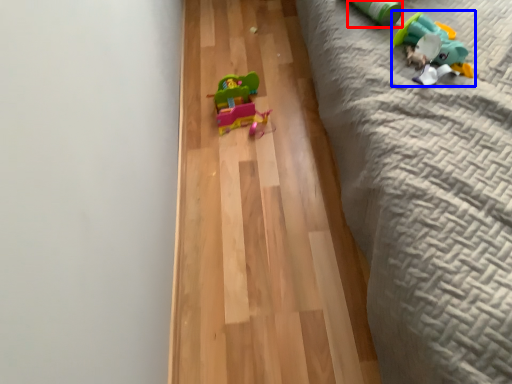
Question: Which object appears farthest to the camera in this image, toy (highlighted by a red box) or toy (highlighted by a blue box)?

Choices:
 (A) toy
 (B) toy

Answer: (A)